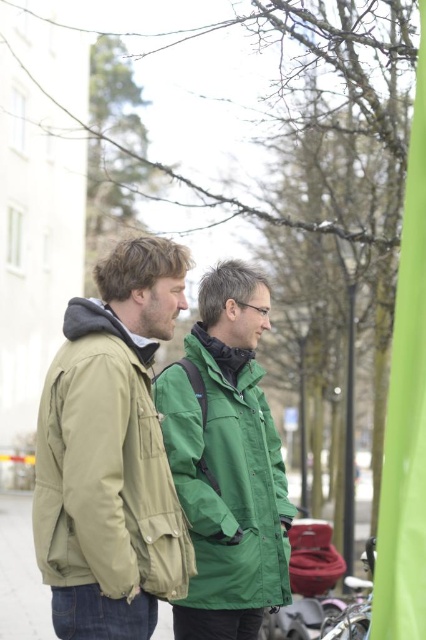
Measure the distance between matte green jacket at center and olive green jacket at left.

They are 1.57 inches apart.

Which is in front, point (146, 618) or point (123, 422)?

Point (123, 422) is in front.

Is point (141, 420) less distant than point (103, 493)?

No.

Where is `matte green jacket at center`? This screenshot has height=640, width=426. matte green jacket at center is located at coordinates (112, 452).

Does matte green jacket at center have a lesser width compared to green matte jacket at center?

Yes.

Which of these two, matte green jacket at center or green matte jacket at center, stands taller?

With more height is matte green jacket at center.

Is point (172, 252) positioned behind point (192, 484)?

That is False.

The width and height of the screenshot is (426, 640). Find the location of `matte green jacket at center`. matte green jacket at center is located at coordinates (112, 452).

Does olive green jacket at left have a smaller size compared to green matte jacket at center?

Yes.

Is olive green jacket at left taller than green matte jacket at center?

Incorrect, olive green jacket at left's height is not larger of green matte jacket at center's.

Is point (169, 541) closer to camera compared to point (195, 429)?

Yes.

This screenshot has height=640, width=426. Find the location of `olive green jacket at left`. olive green jacket at left is located at coordinates (106, 467).